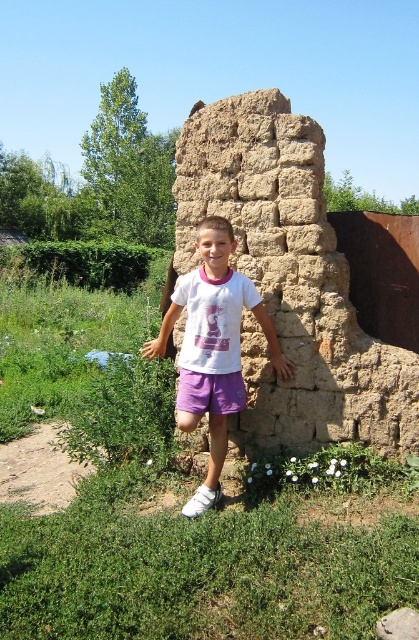
Question: Can you confirm if brown mudbrick wall at center is positioned to the left of white cotton shirt at center?

Choices:
 (A) no
 (B) yes

Answer: (A)

Question: Is brown mudbrick wall at center smaller than white cotton shirt at center?

Choices:
 (A) yes
 (B) no

Answer: (B)

Question: Which of the following is the closest to the observer?

Choices:
 (A) (233, 387)
 (B) (268, 333)
 (C) (41, 531)
 (D) (287, 216)

Answer: (C)

Question: Which of the following is the closest to the observer?

Choices:
 (A) brown mudbrick wall at center
 (B) white cotton shirt at center

Answer: (B)

Question: Is green grass at center behind brown mudbrick wall at center?

Choices:
 (A) yes
 (B) no

Answer: (B)

Question: Among these objects, which one is nearest to the camera?

Choices:
 (A) green grass at center
 (B) purple cotton shorts at center
 (C) brown mudbrick wall at center

Answer: (A)